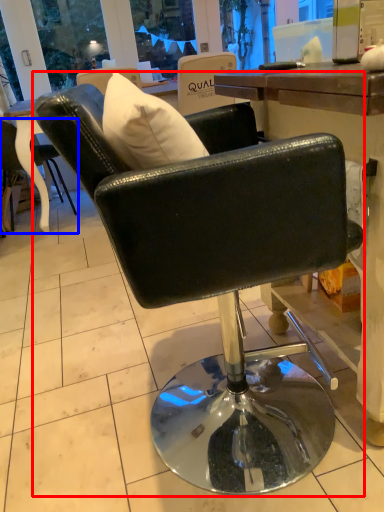
Question: Which object is closer to the camera taking this photo, chair (highlighted by a red box) or chair (highlighted by a blue box)?

Choices:
 (A) chair
 (B) chair

Answer: (A)